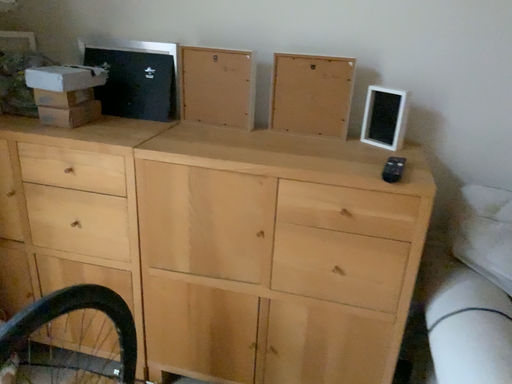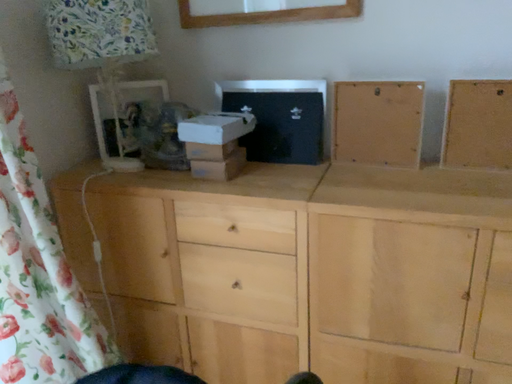
Question: Which way did the camera rotate in the video?

Choices:
 (A) rotated left
 (B) rotated right

Answer: (A)